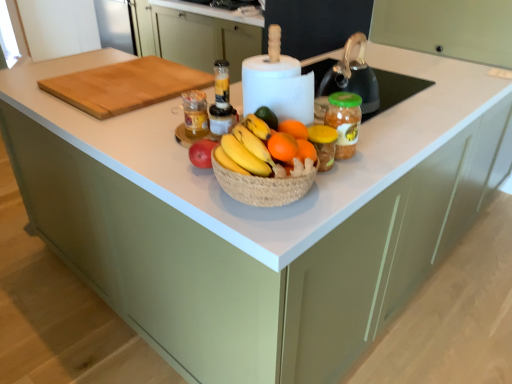
Question: Considering the relative sizes of translucent glass jar at center, the 2th bottle viewed from the right, and translucent plastic blender at center, which is the 2th bottle in left-to-right order, in the image provided, is translucent glass jar at center, the 2th bottle viewed from the right, shorter than translucent plastic blender at center, which is the 2th bottle in left-to-right order,?

Choices:
 (A) no
 (B) yes

Answer: (B)

Question: Is translucent glass jar at center, the 2th bottle viewed from the right, at the right side of translucent plastic blender at center, which is the 2th bottle in left-to-right order?

Choices:
 (A) yes
 (B) no

Answer: (B)

Question: Does translucent glass jar at center, marked as the 1th bottle in a left-to-right arrangement, have a larger size compared to translucent plastic blender at center, which is the 2th bottle in left-to-right order?

Choices:
 (A) no
 (B) yes

Answer: (B)

Question: Is translucent glass jar at center, the 2th bottle viewed from the right, directly adjacent to translucent plastic blender at center, which is the 2th bottle in left-to-right order?

Choices:
 (A) no
 (B) yes

Answer: (B)

Question: Can you confirm if translucent glass jar at center, the 2th bottle viewed from the right, is wider than translucent plastic blender at center, which is the 2th bottle in left-to-right order?

Choices:
 (A) yes
 (B) no

Answer: (A)

Question: Is translucent plastic blender at center, which is the 2th bottle in left-to-right order, a part of translucent glass jar at center, marked as the 1th bottle in a left-to-right arrangement?

Choices:
 (A) yes
 (B) no

Answer: (B)

Question: Does natural wood cutting board at upper left have a greater height compared to orangesmoothfruit at center?

Choices:
 (A) yes
 (B) no

Answer: (A)

Question: Is natural wood cutting board at upper left completely or partially outside of orangesmoothfruit at center?

Choices:
 (A) yes
 (B) no

Answer: (A)

Question: Does natural wood cutting board at upper left have a greater width compared to orangesmoothfruit at center?

Choices:
 (A) yes
 (B) no

Answer: (A)

Question: Is natural wood cutting board at upper left shorter than orangesmoothfruit at center?

Choices:
 (A) yes
 (B) no

Answer: (B)

Question: From a real-world perspective, is natural wood cutting board at upper left under orangesmoothfruit at center?

Choices:
 (A) yes
 (B) no

Answer: (A)

Question: From the image's perspective, is natural wood cutting board at upper left located beneath orangesmoothfruit at center?

Choices:
 (A) yes
 (B) no

Answer: (B)

Question: Is orange matte grapefruit at center bigger than orangesmoothfruit at center?

Choices:
 (A) no
 (B) yes

Answer: (B)